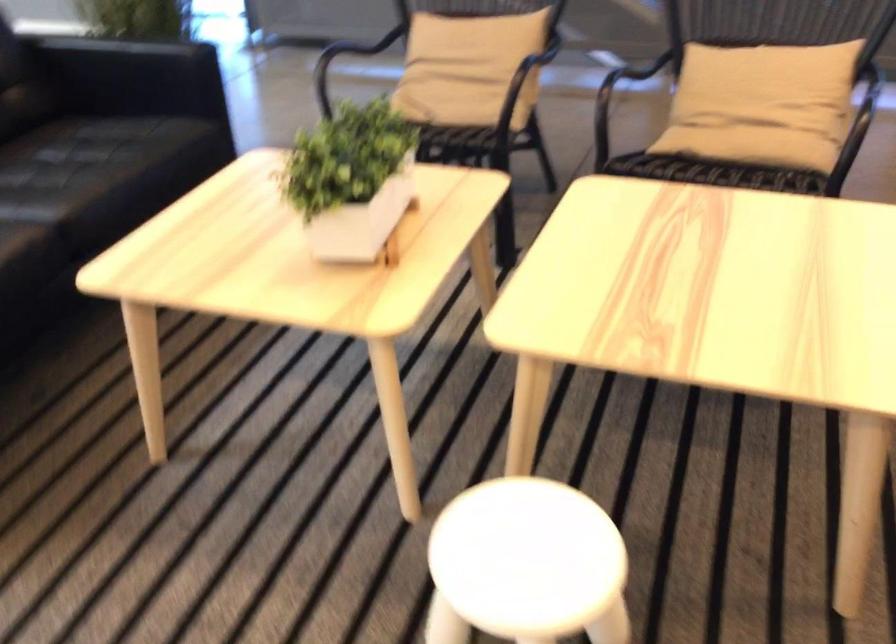
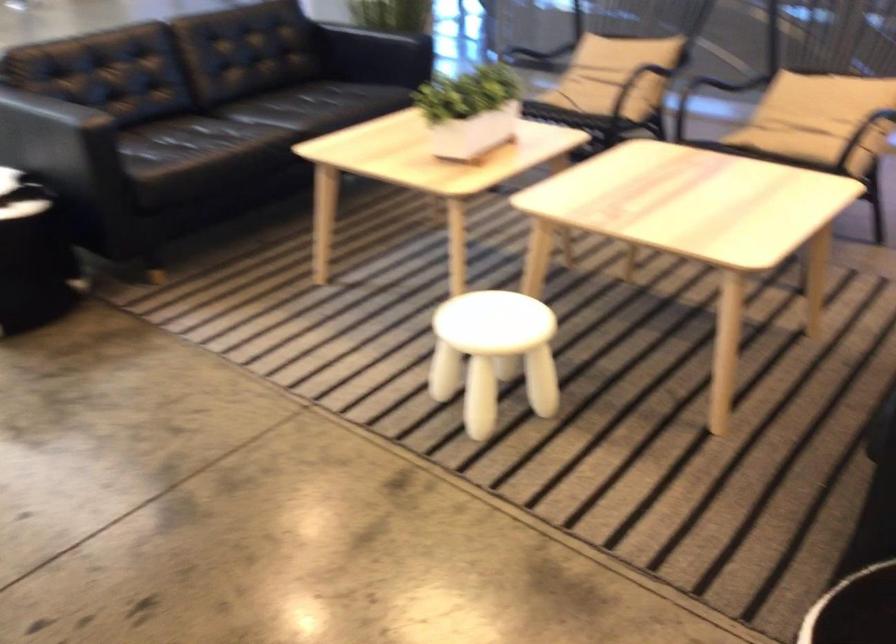
In the second image, find the point that corresponds to point 376,184 in the first image.

(470, 111)